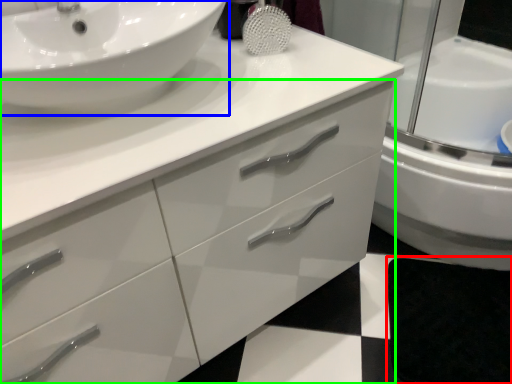
Question: Which object is the closest to the bath mat (highlighted by a red box)? Choose among these: sink (highlighted by a blue box) or bathroom cabinet (highlighted by a green box).

Choices:
 (A) sink
 (B) bathroom cabinet

Answer: (B)